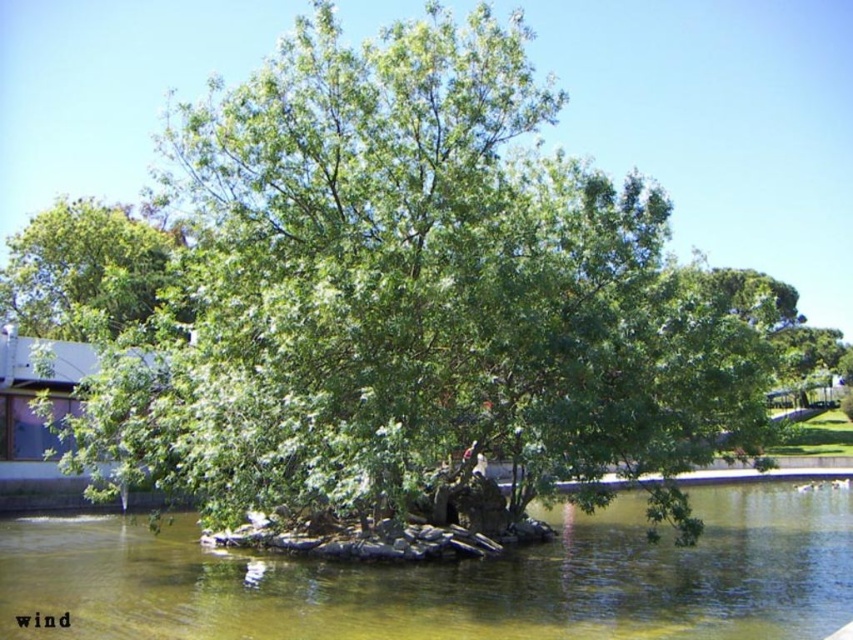
You are standing at the edge of the water in the scene and want to walk towards the two points marked as point (328, 573) and point (154, 269). Which point will you reach first?

Point (328, 573) is in front of point (154, 269), so you will reach point (328, 573) first.